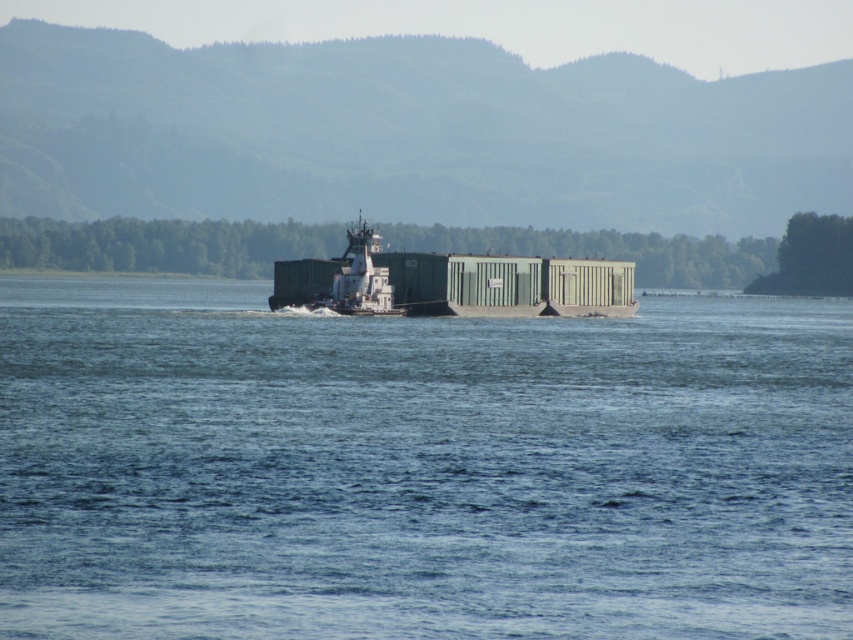
Question: Which point is farther to the camera?

Choices:
 (A) blue water at center
 (B) green matte container ship at center

Answer: (B)

Question: Does blue water at center have a larger size compared to green matte container ship at center?

Choices:
 (A) yes
 (B) no

Answer: (A)

Question: Is the position of blue water at center more distant than that of green matte container ship at center?

Choices:
 (A) yes
 (B) no

Answer: (B)

Question: Which of the following is the farthest from the observer?

Choices:
 (A) (358, 282)
 (B) (642, 593)

Answer: (A)

Question: Does blue water at center have a lesser width compared to green matte container ship at center?

Choices:
 (A) no
 (B) yes

Answer: (A)